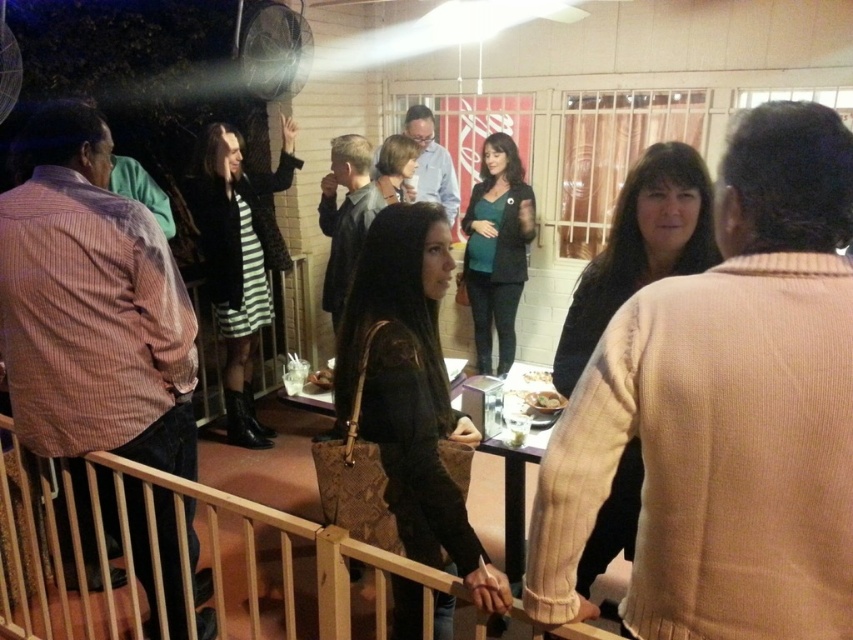
You are standing in the room and see the brown wood rail at center and the striped fabric dress at center. Which object is positioned to the right from your perspective?

The brown wood rail at center is to the right of the striped fabric dress at center.

You are at a party and want to hand a drink to the person wearing the striped fabric dress at center without leaving your current position near the brown wood rail at center. Can you reach them if your arm span is 1.8 meters?

The brown wood rail at center is 1.74 meters away from striped fabric dress at center. Since your arm span is 1.8 meters, you can just barely reach them.

You are a photographer standing at the edge of the brown wood rail at center, preparing to take a photo of the gathering below. Your camera requires a minimum distance of 1.2 meters to focus properly. Will the camera be able to focus on the subjects?

The distance between the brown wood rail at center and the camera is 1.16 meters, which is less than the required 1.2 meters. Therefore, the camera may not focus properly on the subjects.